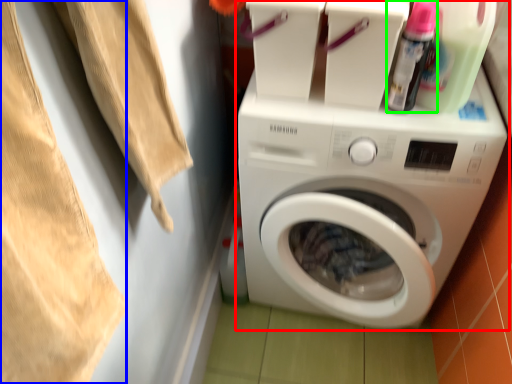
Question: Estimate the real-world distances between objects in this image. Which object is closer to washing machine (highlighted by a red box), clothing (highlighted by a blue box) or cleaning product (highlighted by a green box)?

Choices:
 (A) clothing
 (B) cleaning product

Answer: (B)